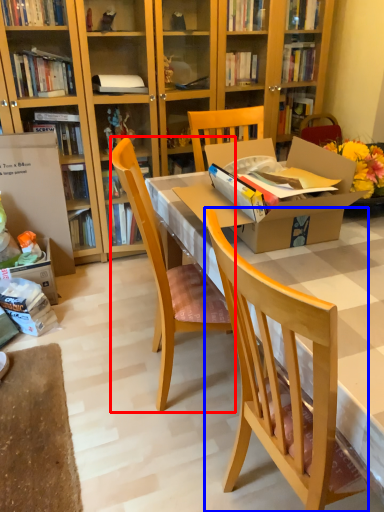
Question: Which object appears farthest to the camera in this image, chair (highlighted by a red box) or chair (highlighted by a blue box)?

Choices:
 (A) chair
 (B) chair

Answer: (A)